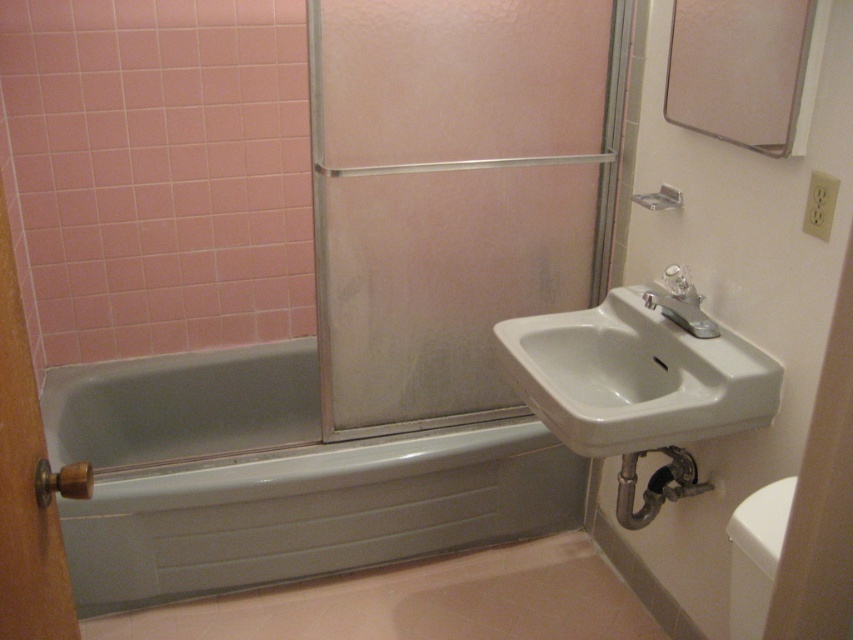
Question: Considering the real-world distances, which object is farthest from the matte silver shower at upper center?

Choices:
 (A) white glossy toilet bowl at lower right
 (B) wooden knob at left
 (C) satin nickel faucet at right

Answer: (B)

Question: Which of these objects is positioned farthest from the white glossy toilet bowl at lower right?

Choices:
 (A) white glossy bathtub at lower left
 (B) white ceramic sink at right

Answer: (A)

Question: Can you confirm if wooden knob at left is wider than satin nickel faucet at right?

Choices:
 (A) yes
 (B) no

Answer: (B)

Question: Considering the real-world distances, which object is farthest from the white glossy toilet bowl at lower right?

Choices:
 (A) frosted glass shower door at center
 (B) white glossy bathtub at lower left

Answer: (B)

Question: Does frosted glass shower door at center have a smaller size compared to satin nickel faucet at right?

Choices:
 (A) no
 (B) yes

Answer: (A)

Question: Can you confirm if white glossy bathtub at lower left is positioned to the right of white ceramic sink at right?

Choices:
 (A) yes
 (B) no

Answer: (B)